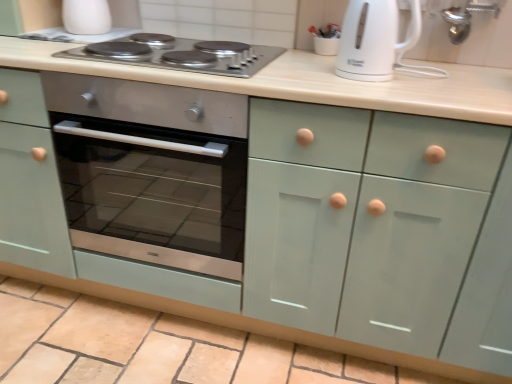
Question: Is stainless steel cooktop at upper center aimed at white glossy electric kettle at upper right?

Choices:
 (A) no
 (B) yes

Answer: (A)

Question: Does stainless steel cooktop at upper center contain white glossy electric kettle at upper right?

Choices:
 (A) yes
 (B) no

Answer: (B)

Question: From a real-world perspective, is stainless steel cooktop at upper center below white glossy electric kettle at upper right?

Choices:
 (A) no
 (B) yes

Answer: (B)

Question: From a real-world perspective, is stainless steel cooktop at upper center on white glossy electric kettle at upper right?

Choices:
 (A) no
 (B) yes

Answer: (A)

Question: Is stainless steel cooktop at upper center positioned behind white glossy electric kettle at upper right?

Choices:
 (A) yes
 (B) no

Answer: (A)

Question: From the image's perspective, is stainless steel cooktop at upper center over white glossy electric kettle at upper right?

Choices:
 (A) no
 (B) yes

Answer: (B)

Question: Can you confirm if white glossy cup at upper left is smaller than white glossy electric kettle at upper right?

Choices:
 (A) no
 (B) yes

Answer: (B)

Question: Considering the relative positions of white glossy cup at upper left and white glossy electric kettle at upper right in the image provided, is white glossy cup at upper left to the right of white glossy electric kettle at upper right from the viewer's perspective?

Choices:
 (A) no
 (B) yes

Answer: (A)

Question: From the image's perspective, does white glossy cup at upper left appear lower than white glossy electric kettle at upper right?

Choices:
 (A) no
 (B) yes

Answer: (A)

Question: Can you confirm if white glossy cup at upper left is thinner than white glossy electric kettle at upper right?

Choices:
 (A) yes
 (B) no

Answer: (A)

Question: From a real-world perspective, is white glossy cup at upper left beneath white glossy electric kettle at upper right?

Choices:
 (A) yes
 (B) no

Answer: (A)

Question: From a real-world perspective, is white glossy cup at upper left located higher than white glossy electric kettle at upper right?

Choices:
 (A) no
 (B) yes

Answer: (A)

Question: Can you confirm if white glossy cup at upper left is thinner than stainless steel cooktop at upper center?

Choices:
 (A) yes
 (B) no

Answer: (A)